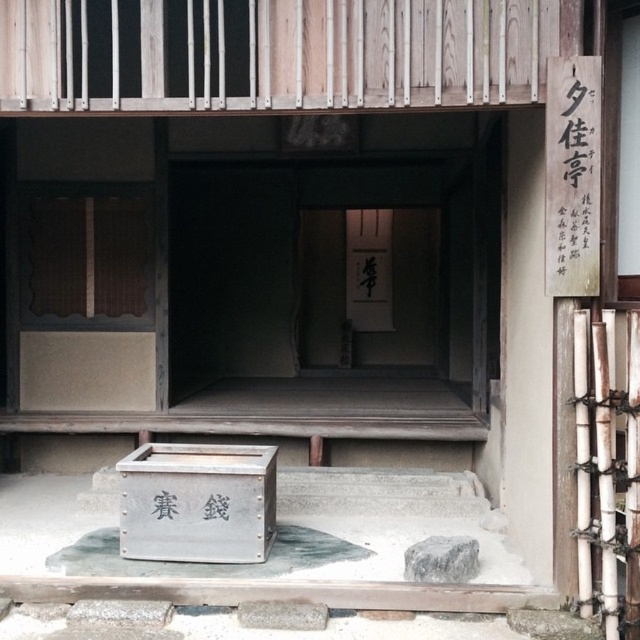
Who is taller, black wood sign at upper right or white paper at center?

white paper at center

Between black wood sign at upper right and white paper at center, which one appears on the right side from the viewer's perspective?

From the viewer's perspective, black wood sign at upper right appears more on the right side.

Is point (570, 156) farther from viewer compared to point (390, 253)?

No, it is not.

Where is `black wood sign at upper right`? This screenshot has height=640, width=640. black wood sign at upper right is located at coordinates (573, 180).